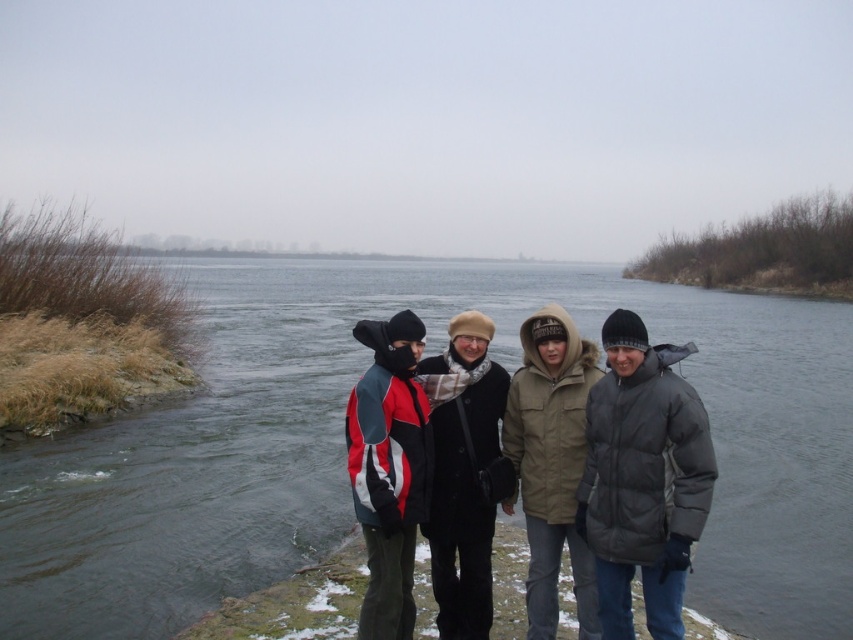
Can you confirm if gray down jacket at center is shorter than khaki woolen coat at center?

Yes, gray down jacket at center is shorter than khaki woolen coat at center.

Is gray down jacket at center to the left of khaki woolen coat at center from the viewer's perspective?

In fact, gray down jacket at center is to the right of khaki woolen coat at center.

Between point (627, 397) and point (560, 442), which one is positioned in front?

Point (627, 397) is in front.

Where is `gray down jacket at center`? The image size is (853, 640). gray down jacket at center is located at coordinates (642, 477).

Looking at this image, is khaki woolen coat at center thinner than black wool coat at center?

Yes, khaki woolen coat at center is thinner than black wool coat at center.

Is khaki woolen coat at center shorter than black wool coat at center?

Correct, khaki woolen coat at center is not as tall as black wool coat at center.

Who is more distant from viewer, (548,372) or (473,404)?

Point (473,404)

At what (x,y) coordinates should I click in order to perform the action: click on khaki woolen coat at center. Please return your answer as a coordinate pair (x, y). The width and height of the screenshot is (853, 640). Looking at the image, I should click on (550, 461).

How far apart are khaki woolen coat at center and red and gray jacket at center?

The distance of khaki woolen coat at center from red and gray jacket at center is 36.59 inches.

Is khaki woolen coat at center bigger than red and gray jacket at center?

No, khaki woolen coat at center is not bigger than red and gray jacket at center.

Identify the location of khaki woolen coat at center. (550, 461).